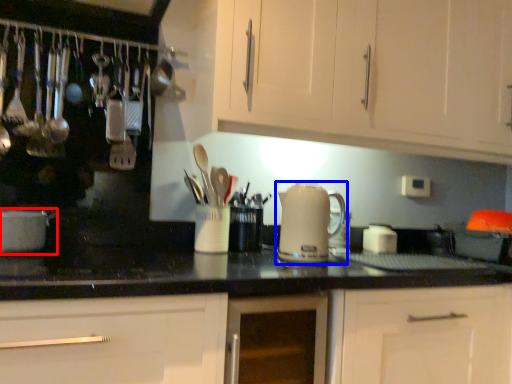
Question: Which point is closer to the camera, home appliance (highlighted by a red box) or kitchen appliance (highlighted by a blue box)?

Choices:
 (A) home appliance
 (B) kitchen appliance

Answer: (A)